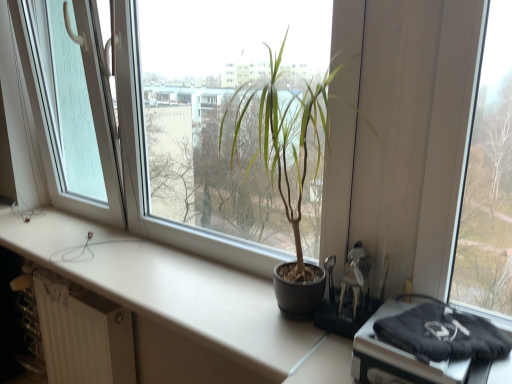
Question: Is transparent glass door at left wider than white matte counter top at center?

Choices:
 (A) no
 (B) yes

Answer: (A)

Question: Considering the relative sizes of transparent glass door at left and white matte counter top at center in the image provided, is transparent glass door at left bigger than white matte counter top at center?

Choices:
 (A) yes
 (B) no

Answer: (A)

Question: Is transparent glass door at left in front of white matte counter top at center?

Choices:
 (A) yes
 (B) no

Answer: (B)

Question: From the image's perspective, does transparent glass door at left appear higher than white matte counter top at center?

Choices:
 (A) yes
 (B) no

Answer: (A)

Question: Is transparent glass door at left at the right side of white matte counter top at center?

Choices:
 (A) no
 (B) yes

Answer: (A)

Question: Could you tell me if transparent glass door at left is facing white matte counter top at center?

Choices:
 (A) yes
 (B) no

Answer: (B)

Question: Does white matte counter top at center have a lesser height compared to matte black pot at center?

Choices:
 (A) yes
 (B) no

Answer: (A)

Question: Would you say white matte counter top at center is a long distance from matte black pot at center?

Choices:
 (A) no
 (B) yes

Answer: (A)

Question: Considering the relative sizes of white matte counter top at center and matte black pot at center in the image provided, is white matte counter top at center smaller than matte black pot at center?

Choices:
 (A) yes
 (B) no

Answer: (A)

Question: Can you confirm if white matte counter top at center is thinner than matte black pot at center?

Choices:
 (A) yes
 (B) no

Answer: (B)

Question: Can you confirm if white matte counter top at center is wider than matte black pot at center?

Choices:
 (A) yes
 (B) no

Answer: (A)

Question: From the image's perspective, does white matte counter top at center appear lower than matte black pot at center?

Choices:
 (A) yes
 (B) no

Answer: (A)

Question: Does transparent glass door at left have a greater width compared to white textured radiator at lower left?

Choices:
 (A) no
 (B) yes

Answer: (B)